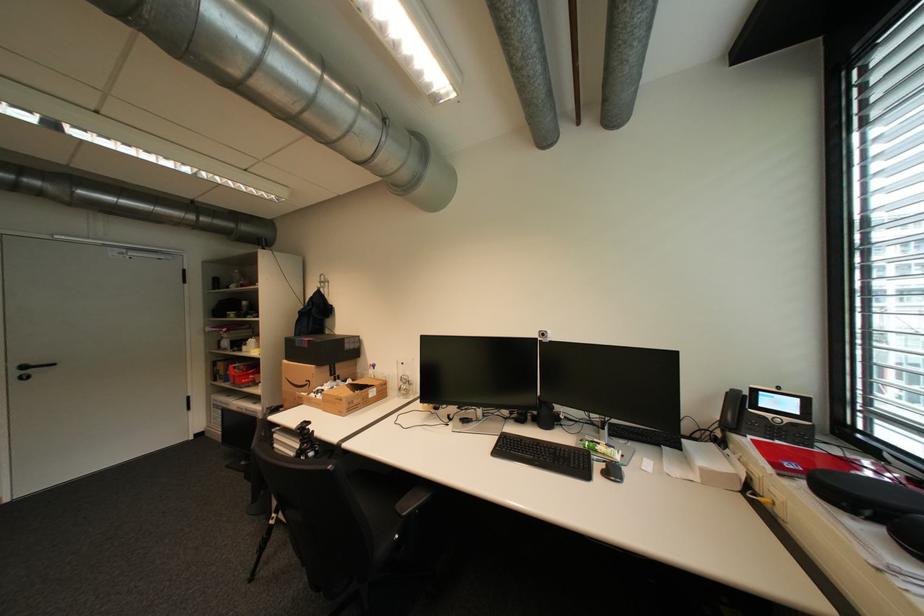
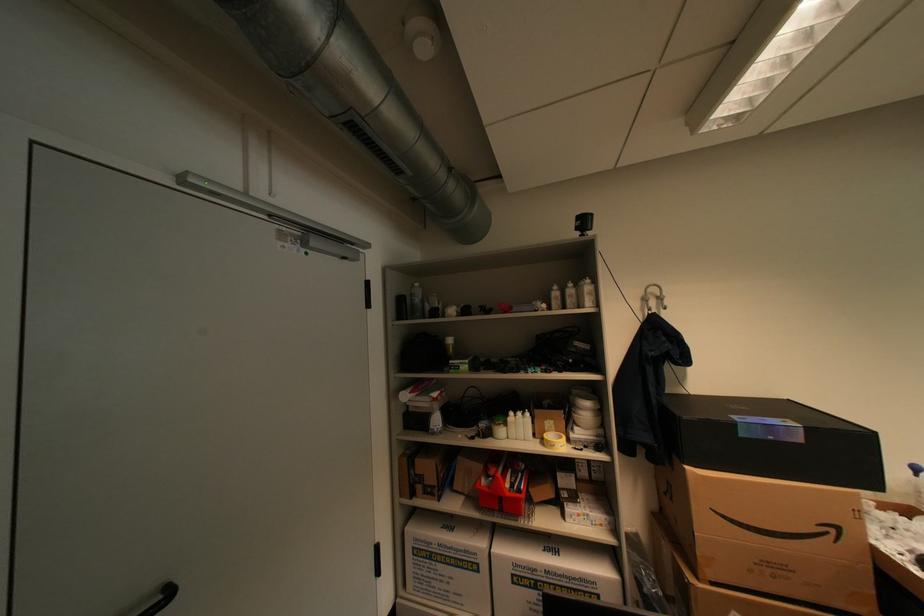
Find the pixel in the second image that matches [225,407] in the first image.

(439, 556)